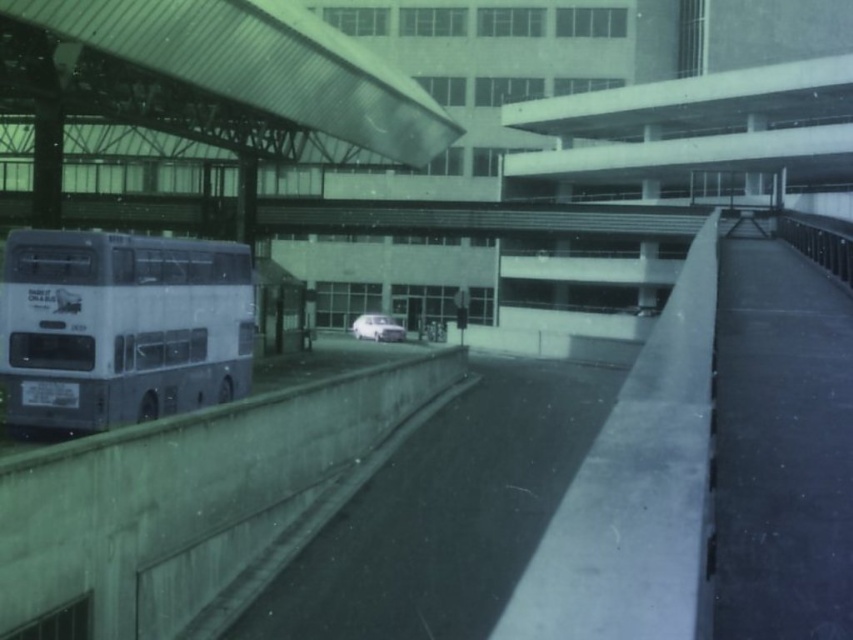
Question: Which object appears closest to the camera in this image?

Choices:
 (A) silver metallic bus at left
 (B) white matte van at center

Answer: (A)

Question: Is silver metallic bus at left positioned before white matte van at center?

Choices:
 (A) yes
 (B) no

Answer: (A)

Question: Among these objects, which one is nearest to the camera?

Choices:
 (A) silver metallic bus at left
 (B) white matte van at center

Answer: (A)

Question: From the image, what is the correct spatial relationship of silver metallic bus at left in relation to white matte van at center?

Choices:
 (A) left
 (B) right

Answer: (A)

Question: Does silver metallic bus at left have a smaller size compared to white matte van at center?

Choices:
 (A) no
 (B) yes

Answer: (A)